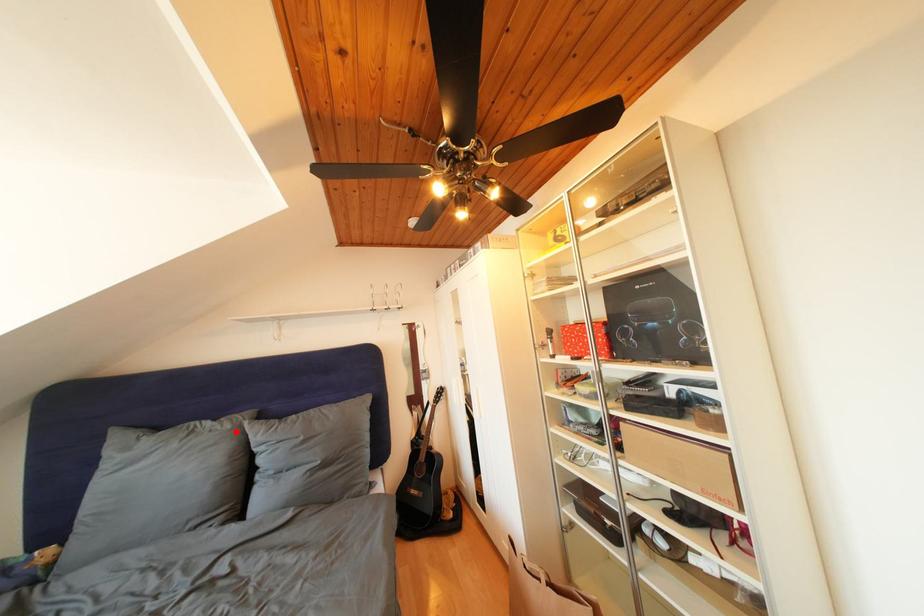
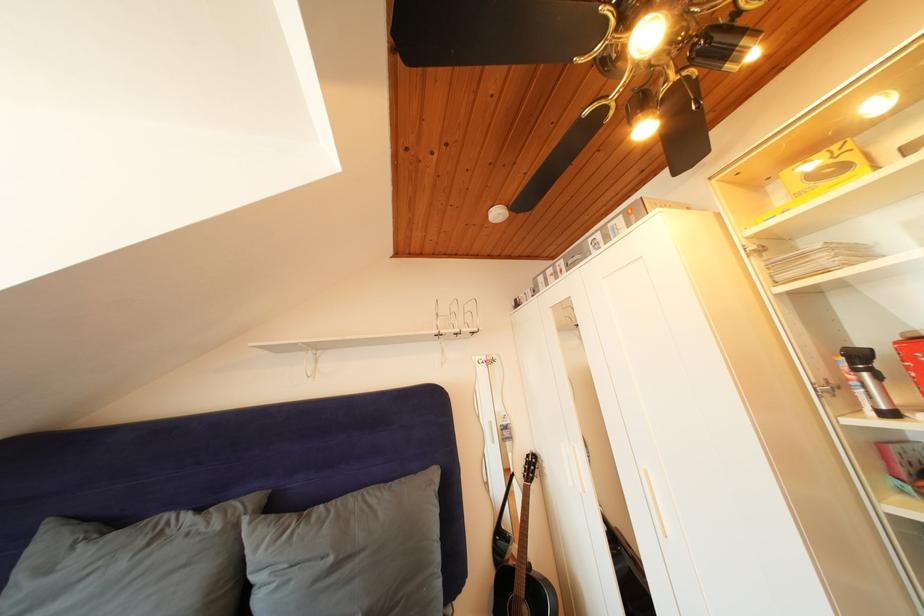
Find the pixel in the second image that matches the highlighted location in the first image.

(225, 531)